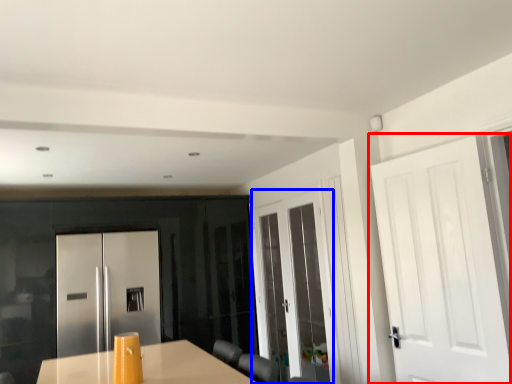
Question: Among these objects, which one is nearest to the camera, door (highlighted by a red box) or door (highlighted by a blue box)?

Choices:
 (A) door
 (B) door

Answer: (A)